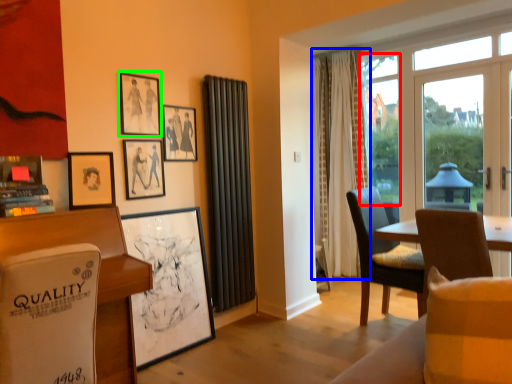
Question: Considering the real-world distances, which object is closest to window screen (highlighted by a red box)? curtain (highlighted by a blue box) or picture frame (highlighted by a green box).

Choices:
 (A) curtain
 (B) picture frame

Answer: (A)